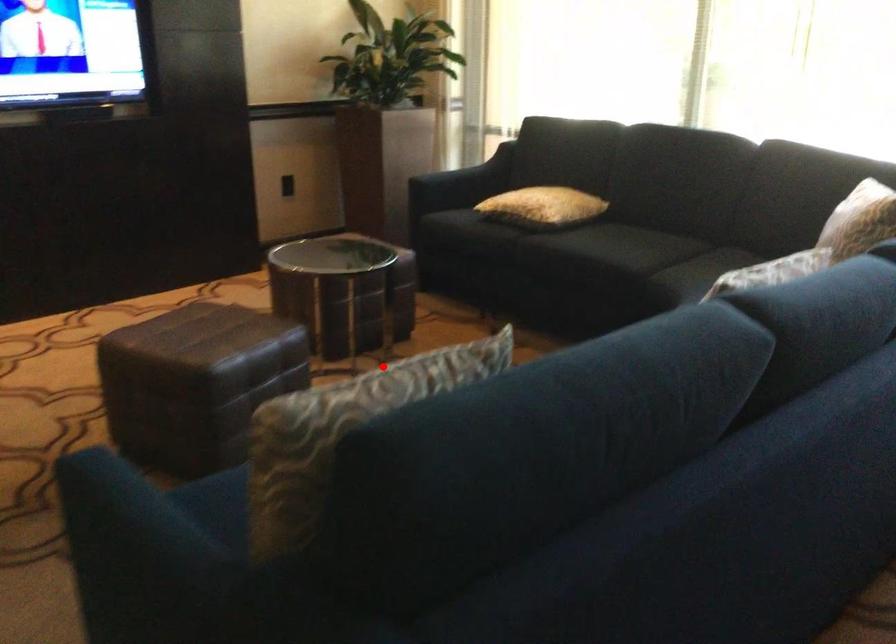
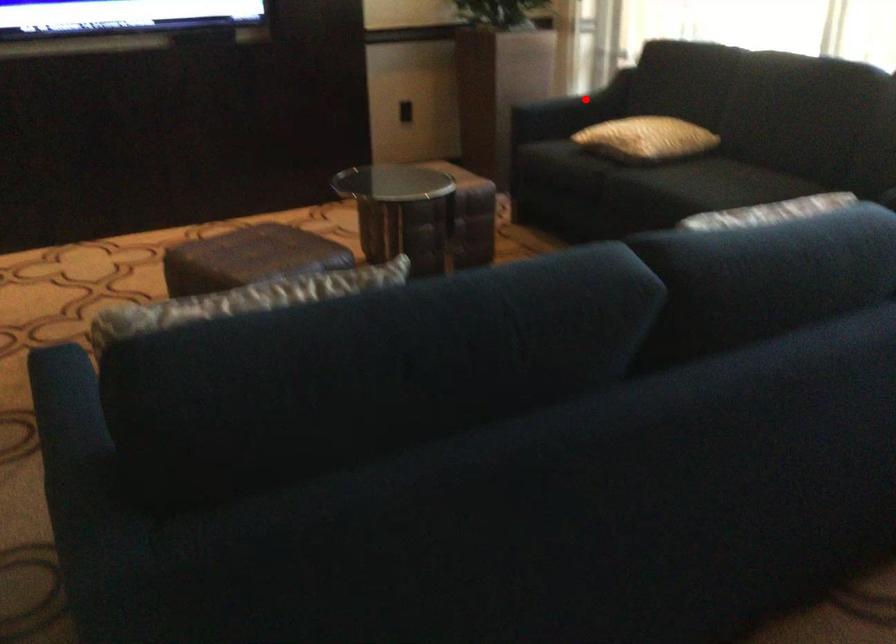
I am providing you with two images of the same scene from different viewpoints. A red point is marked on the first image and another point is marked on the second image. Do the highlighted points in image1 and image2 indicate the same real-world spot?

No